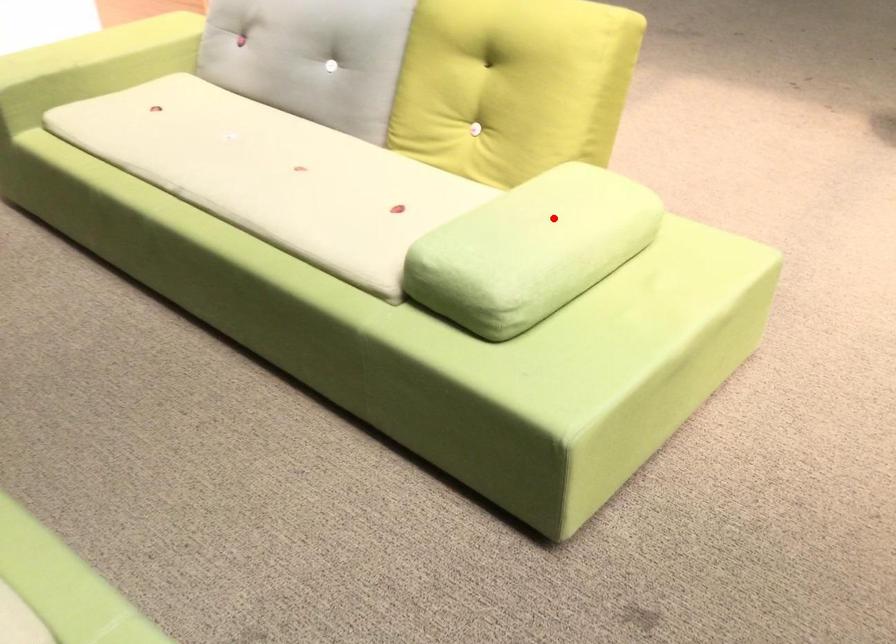
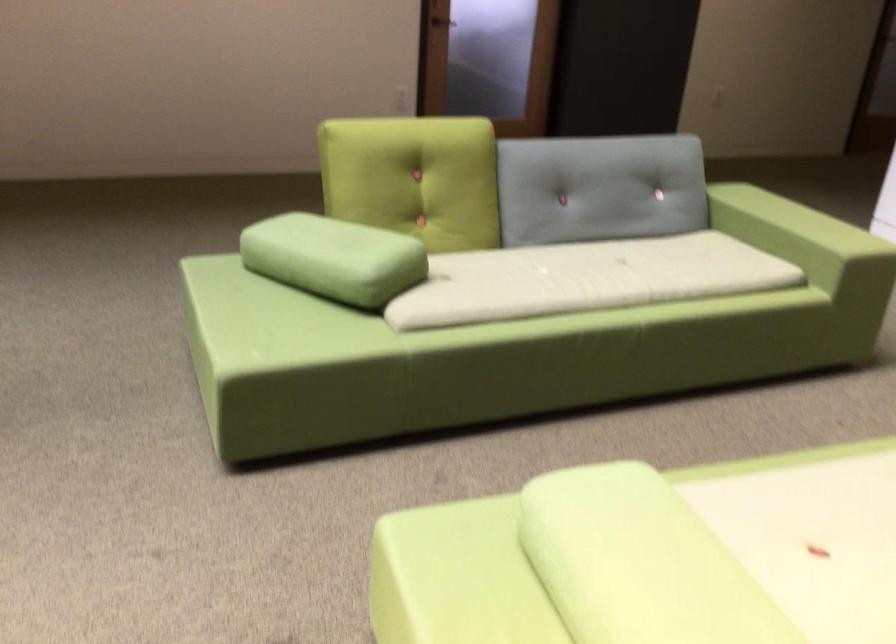
Question: I am providing you with two images of the same scene from different viewpoints. In image1, a red point is highlighted. Considering the same 3D point in image2, which of the following is correct?

Choices:
 (A) It is closer
 (B) It is farther

Answer: (A)